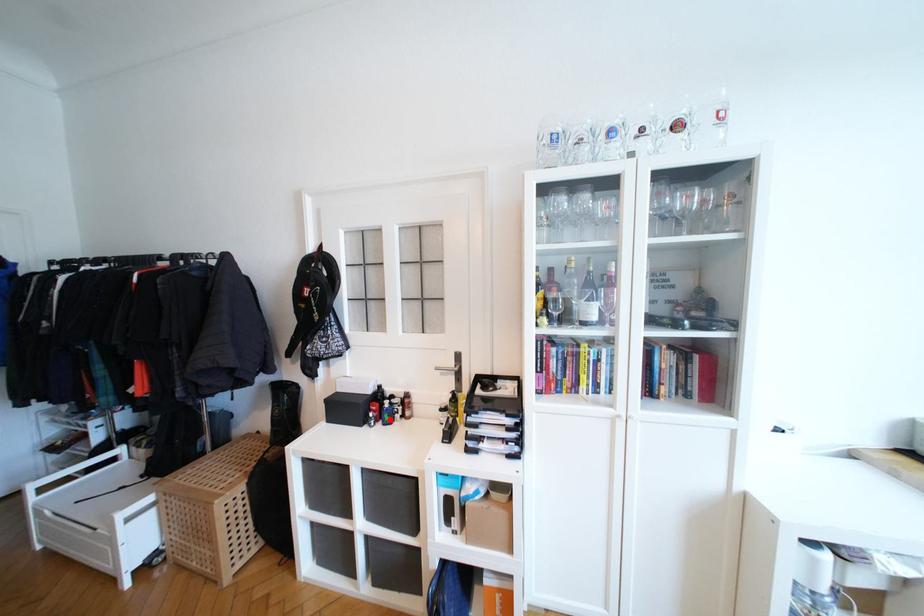
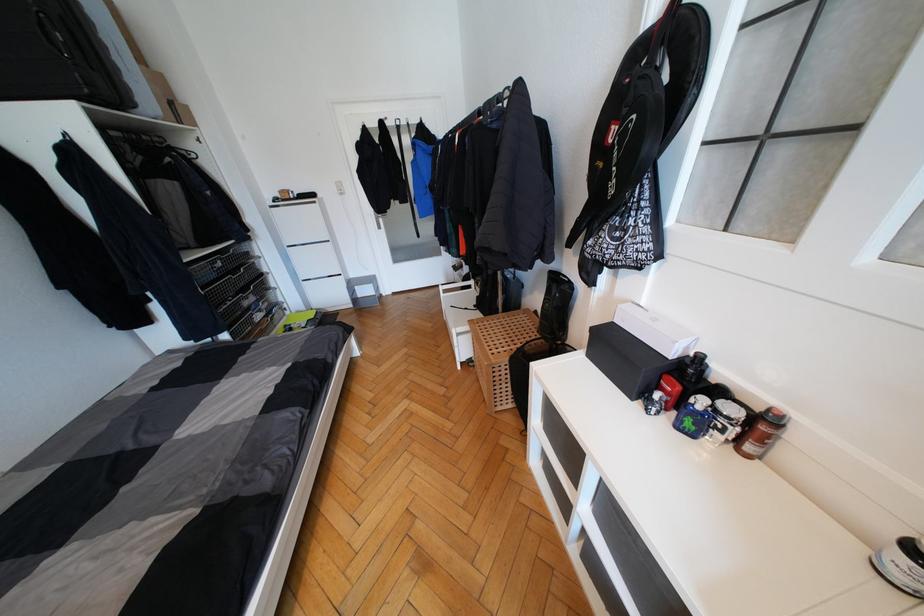
Where in the second image is the point corresponding to the highlighted location from the first image?

(691, 426)